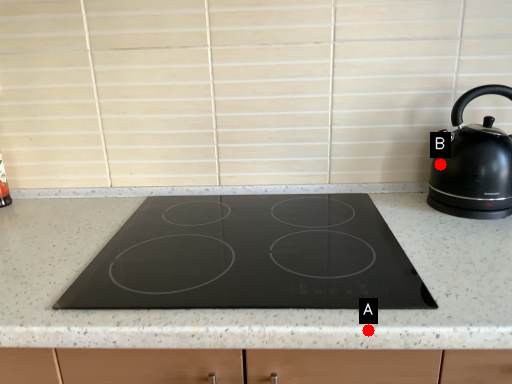
Question: Two points are circled on the image, labeled by A and B beside each circle. Which of the following is the farthest from the observer?

Choices:
 (A) A is further
 (B) B is further

Answer: (B)